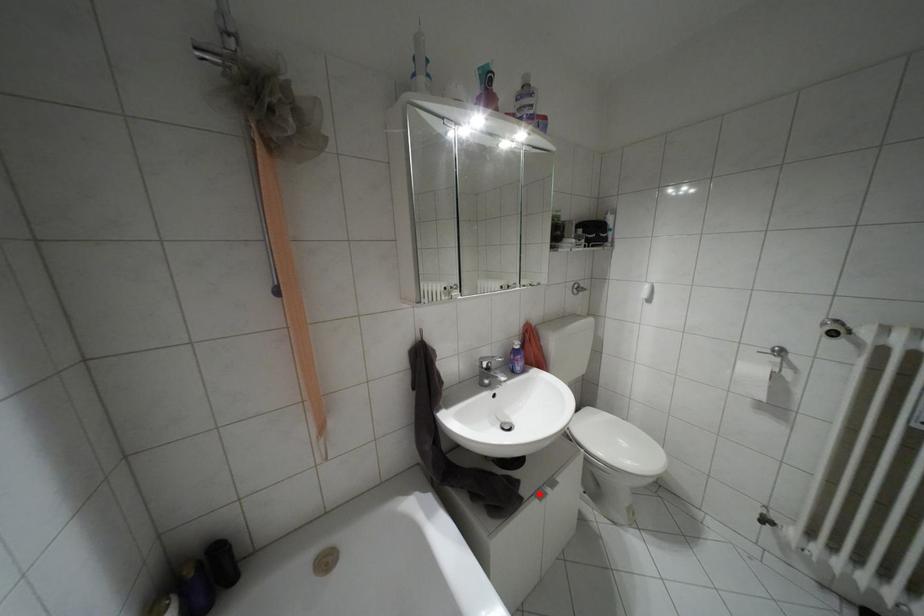
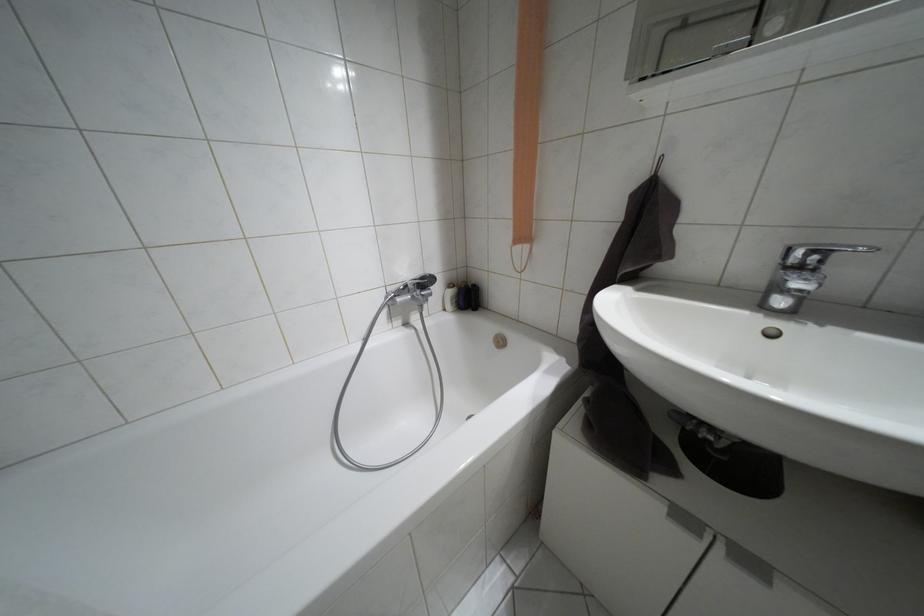
Question: I am providing you with two images of the same scene from different viewpoints. A red point is marked on the first image. Is the red point's position out of view in image 2?

Choices:
 (A) Yes
 (B) No

Answer: (B)